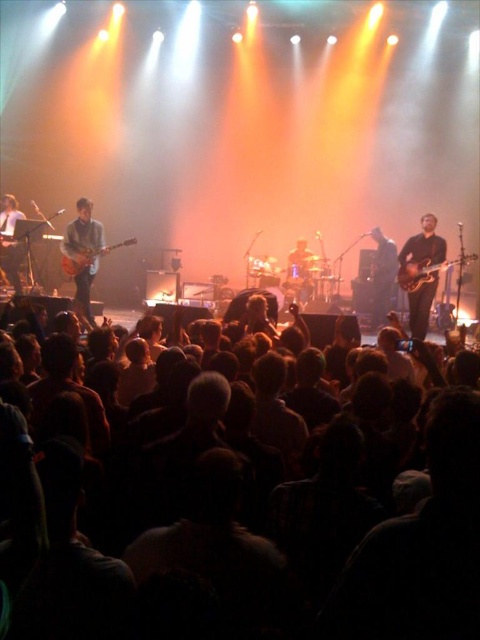
Can you confirm if shiny black guitar at center is positioned below wooden electric guitar at left?

Yes, shiny black guitar at center is below wooden electric guitar at left.

Can you confirm if shiny black guitar at center is positioned to the right of wooden electric guitar at left?

Indeed, shiny black guitar at center is positioned on the right side of wooden electric guitar at left.

The width and height of the screenshot is (480, 640). In order to click on shiny black guitar at center in this screenshot , I will do `click(383, 276)`.

Is shiny black guitar at center shorter than glossy wood guitar at right?

Incorrect, shiny black guitar at center's height does not fall short of glossy wood guitar at right's.

The height and width of the screenshot is (640, 480). I want to click on shiny black guitar at center, so click(383, 276).

Can you confirm if dark matte crowd at lower center is positioned above wooden electric guitar at left?

No.

The height and width of the screenshot is (640, 480). What do you see at coordinates (172, 570) in the screenshot?
I see `dark matte crowd at lower center` at bounding box center [172, 570].

You are a GUI agent. You are given a task and a screenshot of the screen. Output one action in this format:
    pyautogui.click(x=<x>, y=<y>)
    Task: Click on the dark matte crowd at lower center
    This screenshot has height=640, width=480.
    Given the screenshot: What is the action you would take?
    pyautogui.click(x=172, y=570)